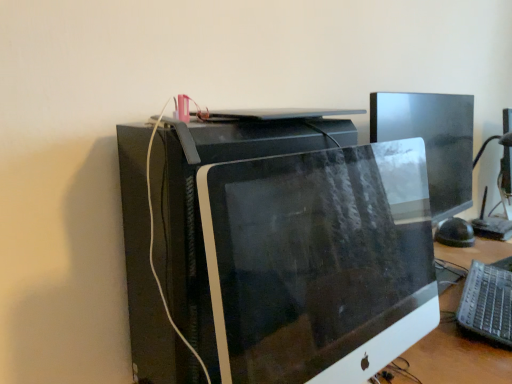
Question: Considering the positions of silver metallic keyboard at lower right and matte black monitor at center in the image, is silver metallic keyboard at lower right bigger or smaller than matte black monitor at center?

Choices:
 (A) small
 (B) big

Answer: (A)

Question: Is silver metallic keyboard at lower right to the left or to the right of matte black monitor at center in the image?

Choices:
 (A) right
 (B) left

Answer: (A)

Question: From the image's perspective, is silver metallic keyboard at lower right positioned above or below matte black monitor at center?

Choices:
 (A) above
 (B) below

Answer: (B)

Question: Is matte black monitor at center taller or shorter than silver metallic keyboard at lower right?

Choices:
 (A) short
 (B) tall

Answer: (B)

Question: From the image's perspective, is matte black monitor at center positioned above or below silver metallic keyboard at lower right?

Choices:
 (A) below
 (B) above

Answer: (B)

Question: Considering the positions of point (279, 205) and point (476, 271), is point (279, 205) closer or farther from the camera than point (476, 271)?

Choices:
 (A) closer
 (B) farther

Answer: (A)

Question: From a real-world perspective, is matte black monitor at center positioned above or below silver metallic keyboard at lower right?

Choices:
 (A) above
 (B) below

Answer: (A)